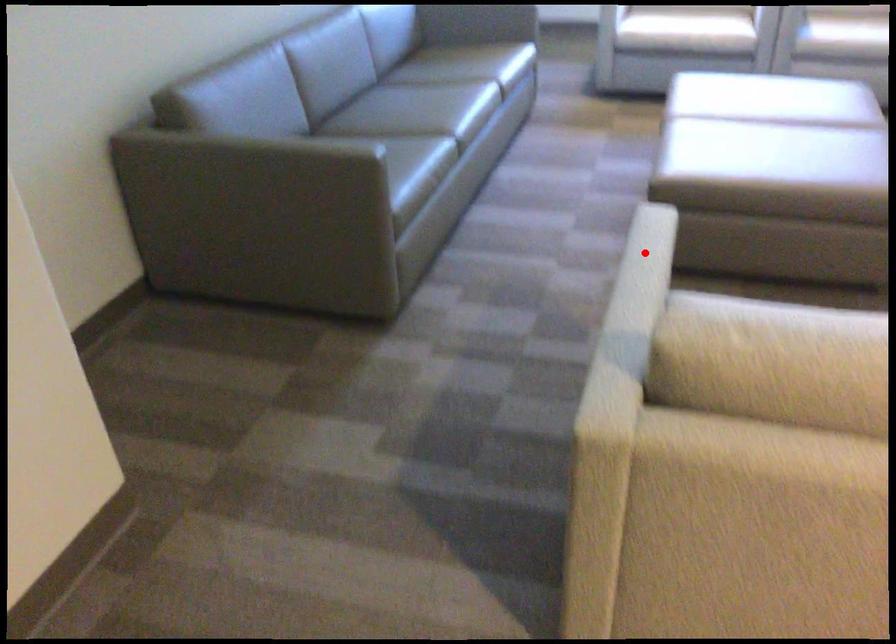
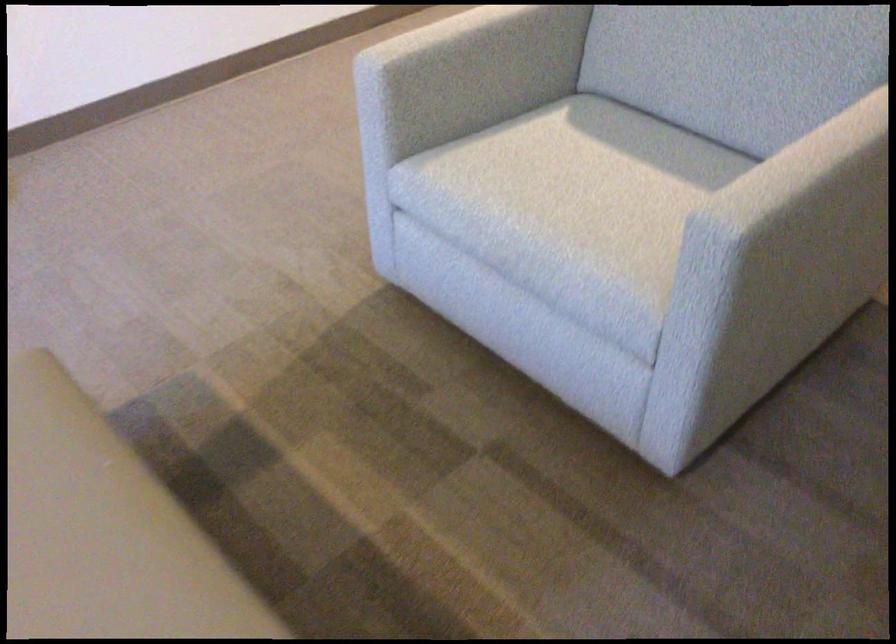
Question: A red point is marked in image1. In image2, is the corresponding 3D point closer to the camera or farther? Reply with the corresponding letter.

Choices:
 (A) The corresponding 3D point is closer.
 (B) The corresponding 3D point is farther.

Answer: (A)